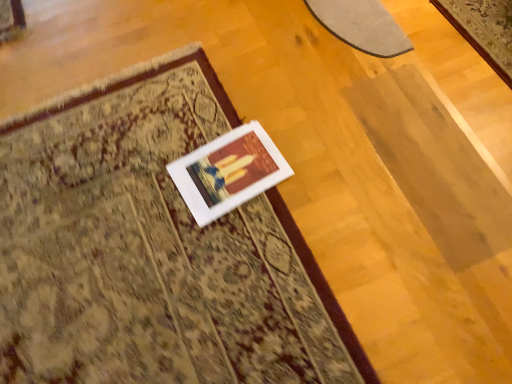
Measure the distance between point [14,139] and camera.

A distance of 1.25 meters exists between point [14,139] and camera.

The height and width of the screenshot is (384, 512). What do you see at coordinates (228, 172) in the screenshot?
I see `white matte picture frame at center` at bounding box center [228, 172].

How much space does matte gray rug at upper right, which ranks as the first mat in top-to-bottom order, occupy horizontally?

matte gray rug at upper right, which ranks as the first mat in top-to-bottom order, is 9.74 inches in width.

This screenshot has width=512, height=384. Identify the location of beige carpet at center, which is the 2th mat from right to left. (152, 250).

Considering the sizes of objects beige carpet at center, which is the 2th mat from right to left, and white matte picture frame at center in the image provided, who is thinner, beige carpet at center, which is the 2th mat from right to left, or white matte picture frame at center?

white matte picture frame at center is thinner.

The image size is (512, 384). Find the location of `picture frame lying above the beige carpet at center, marked as the second mat in a top-to-bottom arrangement (from the image's perspective)`. picture frame lying above the beige carpet at center, marked as the second mat in a top-to-bottom arrangement (from the image's perspective) is located at coordinates (228, 172).

Is beige carpet at center, the 1th mat positioned from the bottom, taller or shorter than white matte picture frame at center?

Clearly, beige carpet at center, the 1th mat positioned from the bottom, is taller compared to white matte picture frame at center.

From the picture: How different are the orientations of beige carpet at center, which is the 2th mat from right to left, and white matte picture frame at center in degrees?

5.27 degrees separate the facing orientations of beige carpet at center, which is the 2th mat from right to left, and white matte picture frame at center.

Is point (327, 2) in front of point (244, 169)?

No, (327, 2) is behind (244, 169).

Can you confirm if matte gray rug at upper right, the second mat when ordered from front to back, is smaller than white matte picture frame at center?

No.

Considering the sizes of objects matte gray rug at upper right, which is counted as the second mat, starting from the bottom, and white matte picture frame at center in the image provided, who is thinner, matte gray rug at upper right, which is counted as the second mat, starting from the bottom, or white matte picture frame at center?

Thinner between the two is matte gray rug at upper right, which is counted as the second mat, starting from the bottom.

How many degrees apart are the facing directions of matte gray rug at upper right, which ranks as the first mat in top-to-bottom order, and white matte picture frame at center?

The facing directions of matte gray rug at upper right, which ranks as the first mat in top-to-bottom order, and white matte picture frame at center are 6.46 degrees apart.

Is white matte picture frame at center at the right side of beige carpet at center, acting as the 2th mat starting from the back?

Correct, you'll find white matte picture frame at center to the right of beige carpet at center, acting as the 2th mat starting from the back.

Considering the positions of objects white matte picture frame at center and beige carpet at center, marked as the second mat in a top-to-bottom arrangement, in the image provided, who is in front, white matte picture frame at center or beige carpet at center, marked as the second mat in a top-to-bottom arrangement,?

beige carpet at center, marked as the second mat in a top-to-bottom arrangement, is in front.

I want to click on picture frame located above the beige carpet at center, the 1th mat positioned from the bottom (from the image's perspective), so click(228, 172).

Which is closer to the camera, (255, 121) or (133, 257)?

Point (133, 257)

From the picture: Which object is thinner, beige carpet at center, which ranks as the 1th mat in left-to-right order, or matte gray rug at upper right, which ranks as the first mat in top-to-bottom order?

Thinner between the two is matte gray rug at upper right, which ranks as the first mat in top-to-bottom order.

Is beige carpet at center, the 1th mat positioned from the bottom, positioned beyond the bounds of matte gray rug at upper right, marked as the first mat in a right-to-left arrangement?

Indeed, beige carpet at center, the 1th mat positioned from the bottom, is completely outside matte gray rug at upper right, marked as the first mat in a right-to-left arrangement.

Is beige carpet at center, marked as the second mat in a top-to-bottom arrangement, facing away from matte gray rug at upper right, placed as the 2th mat when sorted from left to right?

That's not correct — beige carpet at center, marked as the second mat in a top-to-bottom arrangement, is not looking away from matte gray rug at upper right, placed as the 2th mat when sorted from left to right.

Identify the location of mat above the matte gray rug at upper right, marked as the first mat in a right-to-left arrangement (from a real-world perspective). The height and width of the screenshot is (384, 512). (152, 250).

Is matte gray rug at upper right, which ranks as the first mat in top-to-bottom order, facing towards beige carpet at center, the 1th mat positioned from the bottom?

No, matte gray rug at upper right, which ranks as the first mat in top-to-bottom order, does not turn towards beige carpet at center, the 1th mat positioned from the bottom.

Considering the relative sizes of matte gray rug at upper right, the second mat when ordered from front to back, and beige carpet at center, the 1th mat positioned from the bottom, in the image provided, is matte gray rug at upper right, the second mat when ordered from front to back, thinner than beige carpet at center, the 1th mat positioned from the bottom,?

Correct, the width of matte gray rug at upper right, the second mat when ordered from front to back, is less than that of beige carpet at center, the 1th mat positioned from the bottom.

Which is behind, matte gray rug at upper right, which is counted as the second mat, starting from the bottom, or beige carpet at center, acting as the 2th mat starting from the back?

matte gray rug at upper right, which is counted as the second mat, starting from the bottom, is further from the camera.

Who is taller, matte gray rug at upper right, which is counted as the second mat, starting from the bottom, or beige carpet at center, marked as the second mat in a top-to-bottom arrangement?

Standing taller between the two is matte gray rug at upper right, which is counted as the second mat, starting from the bottom.

In the scene shown: Are white matte picture frame at center and matte gray rug at upper right, which is counted as the second mat, starting from the bottom, located far from each other?

No, white matte picture frame at center is in close proximity to matte gray rug at upper right, which is counted as the second mat, starting from the bottom.

At what (x,y) coordinates should I click in order to perform the action: click on picture frame above the matte gray rug at upper right, the first mat in the back-to-front sequence (from a real-world perspective). Please return your answer as a coordinate pair (x, y). The height and width of the screenshot is (384, 512). Looking at the image, I should click on (228, 172).

Does white matte picture frame at center have a greater height compared to matte gray rug at upper right, the first mat in the back-to-front sequence?

No.

Is white matte picture frame at center to the right of matte gray rug at upper right, the first mat in the back-to-front sequence, from the viewer's perspective?

No, white matte picture frame at center is not to the right of matte gray rug at upper right, the first mat in the back-to-front sequence.

Locate an element on the screen. The image size is (512, 384). picture frame that is above the beige carpet at center, acting as the 2th mat starting from the back (from the image's perspective) is located at coordinates (228, 172).

Where is `picture frame that is on the left side of matte gray rug at upper right, the second mat when ordered from front to back`? picture frame that is on the left side of matte gray rug at upper right, the second mat when ordered from front to back is located at coordinates (228, 172).

When comparing their distances from beige carpet at center, acting as the 2th mat starting from the back, does white matte picture frame at center or matte gray rug at upper right, the first mat in the back-to-front sequence, seem closer?

The object closer to beige carpet at center, acting as the 2th mat starting from the back, is white matte picture frame at center.

Looking at the image, which one is located further to matte gray rug at upper right, the first mat in the back-to-front sequence, beige carpet at center, acting as the 2th mat starting from the back, or white matte picture frame at center?

beige carpet at center, acting as the 2th mat starting from the back, is positioned further to the anchor matte gray rug at upper right, the first mat in the back-to-front sequence.

From the image, which object appears to be farther from beige carpet at center, marked as the second mat in a top-to-bottom arrangement, matte gray rug at upper right, the first mat in the back-to-front sequence, or white matte picture frame at center?

matte gray rug at upper right, the first mat in the back-to-front sequence.

Based on their spatial positions, is beige carpet at center, which ranks as the 1th mat in left-to-right order, or matte gray rug at upper right, the first mat in the back-to-front sequence, closer to white matte picture frame at center?

beige carpet at center, which ranks as the 1th mat in left-to-right order, is positioned closer to the anchor white matte picture frame at center.

Considering their positions, is matte gray rug at upper right, the first mat in the back-to-front sequence, positioned further to white matte picture frame at center than beige carpet at center, the 1th mat positioned from the bottom?

matte gray rug at upper right, the first mat in the back-to-front sequence, is positioned further to the anchor white matte picture frame at center.

From the picture: Based on their spatial positions, is white matte picture frame at center or beige carpet at center, positioned as the first mat in front-to-back order, further from matte gray rug at upper right, placed as the 2th mat when sorted from left to right?

beige carpet at center, positioned as the first mat in front-to-back order, is further to matte gray rug at upper right, placed as the 2th mat when sorted from left to right.

The width and height of the screenshot is (512, 384). I want to click on picture frame between matte gray rug at upper right, marked as the first mat in a right-to-left arrangement, and beige carpet at center, the 1th mat positioned from the bottom, in the up-down direction, so (228, 172).